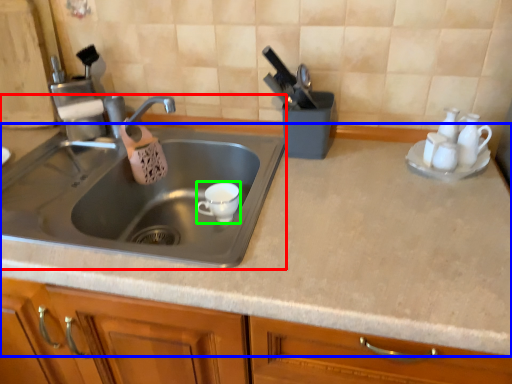
Question: Estimate the real-world distances between objects in this image. Which object is farther from sink (highlighted by a red box), countertop (highlighted by a blue box) or tableware (highlighted by a green box)?

Choices:
 (A) countertop
 (B) tableware

Answer: (A)